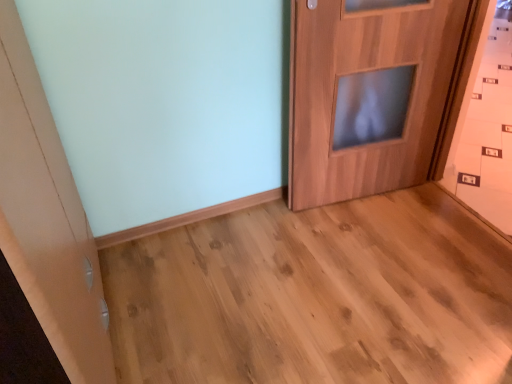
Identify the location of free spot in front of wooden door at center. This screenshot has width=512, height=384. (372, 263).